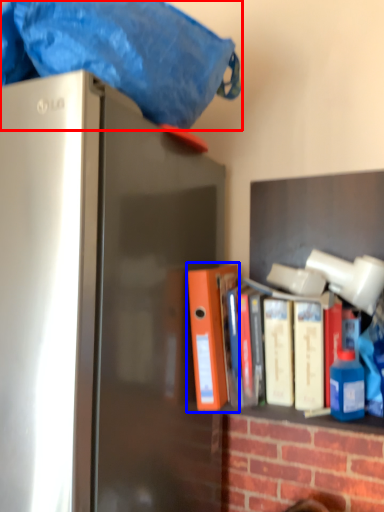
Question: Among these objects, which one is nearest to the camera, blanket (highlighted by a red box) or book (highlighted by a blue box)?

Choices:
 (A) blanket
 (B) book

Answer: (A)